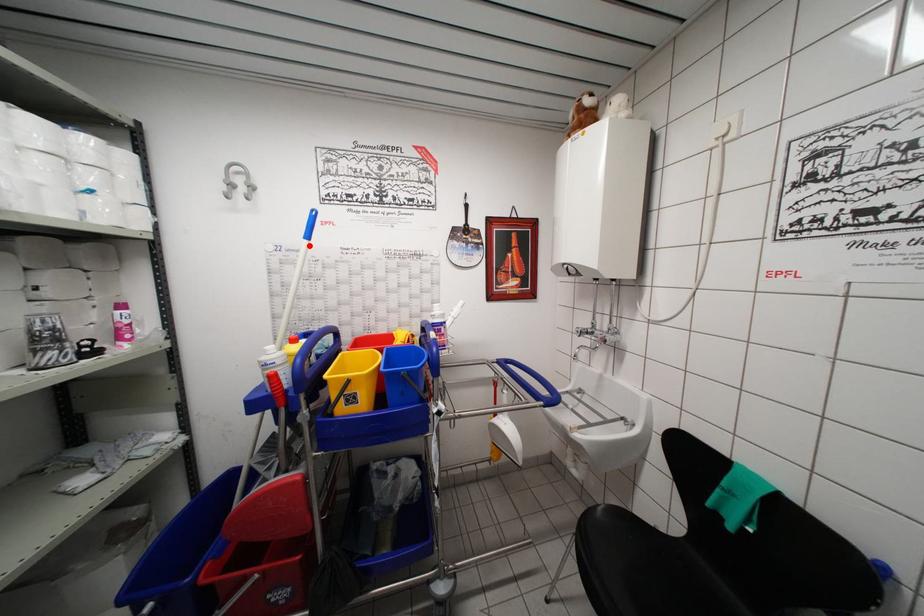
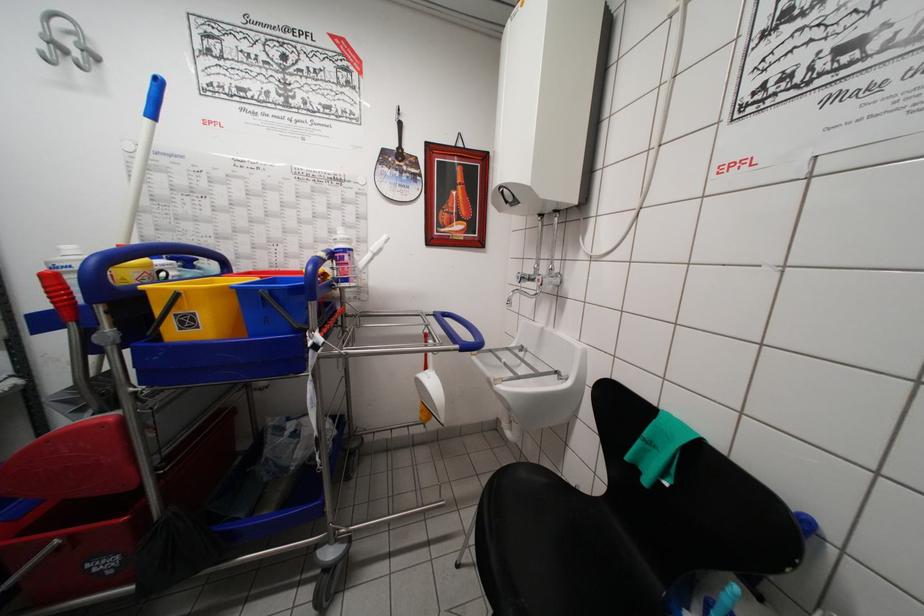
In the second image, find the point that corresponds to the highlighted location in the first image.

(151, 124)